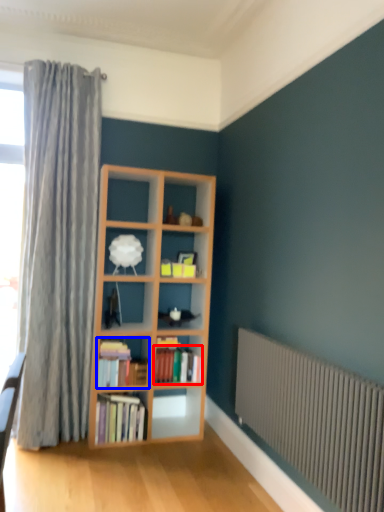
Question: Which point is closer to the camera, book (highlighted by a red box) or book (highlighted by a blue box)?

Choices:
 (A) book
 (B) book

Answer: (B)